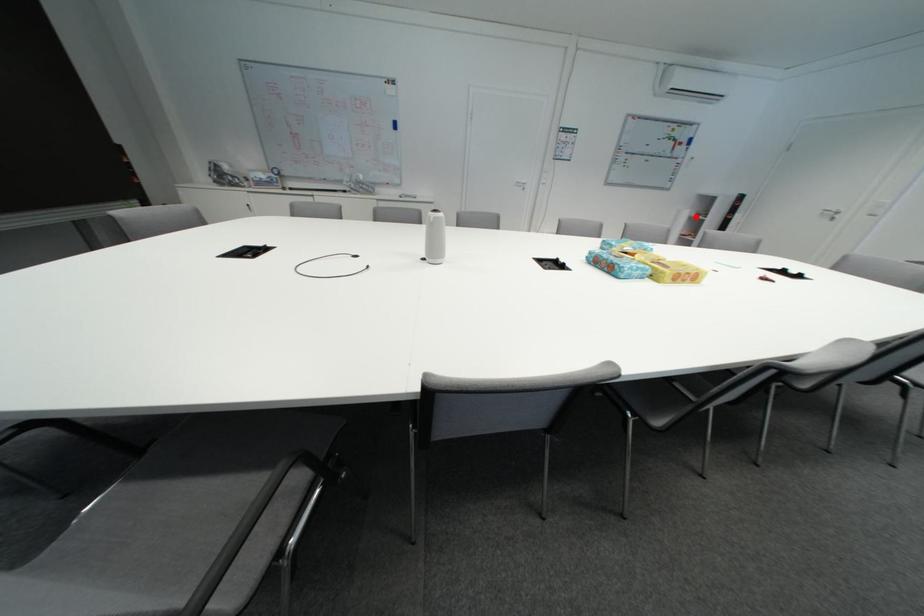
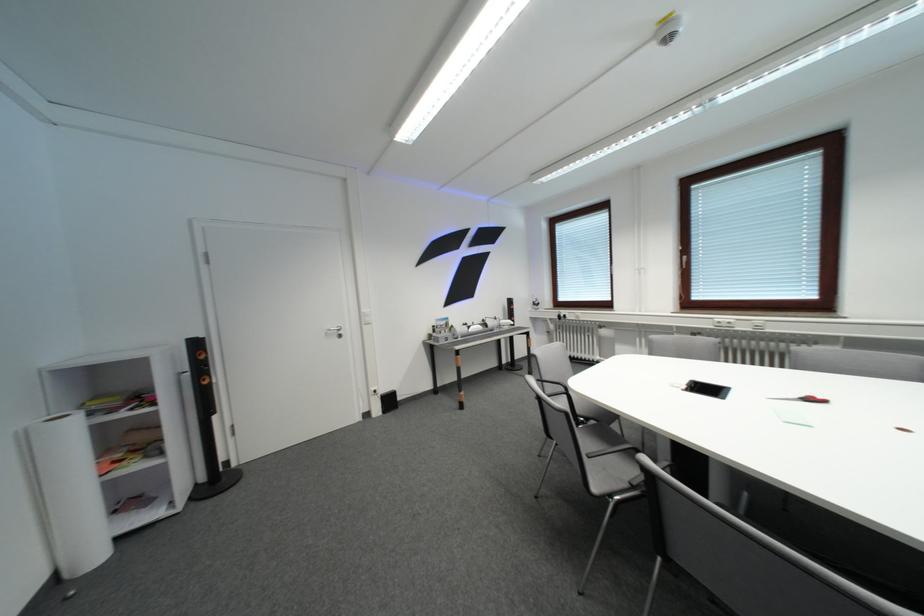
In the second image, find the point that corresponds to the highlighted location in the first image.

(82, 432)